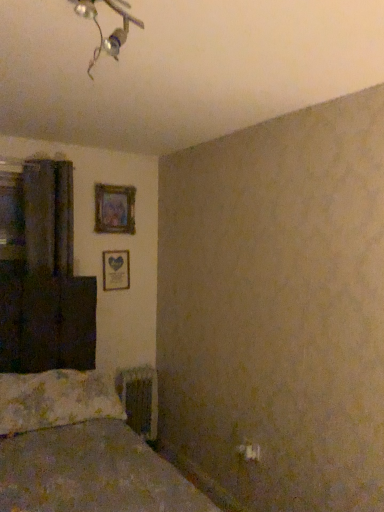
Consider the image. What is the approximate width of wooden frame at upper center, acting as the first picture frame starting from the top?

wooden frame at upper center, acting as the first picture frame starting from the top, is 2.17 inches wide.

From the picture: Measure the distance between metallic radiator at lower center and camera.

metallic radiator at lower center is 10.30 feet from camera.

Locate an element on the screen. The height and width of the screenshot is (512, 384). metallic silver light fixture at upper center is located at coordinates (101, 30).

In order to face wooden picture frame at center-left, which appears as the second picture frame when viewed from the top, should I rotate leftwards or rightwards?

To face it directly, rotate left by 10.067 degrees.

I want to click on wooden frame at upper center, the 2th picture frame ordered from the bottom, so click(x=114, y=209).

Consider the image. Between metallic silver light fixture at upper center and fluffy white pillow at lower left, which one is positioned in front?

metallic silver light fixture at upper center.

How far apart are metallic silver light fixture at upper center and fluffy white pillow at lower left?

metallic silver light fixture at upper center is 5.90 feet from fluffy white pillow at lower left.

Which object is positioned more to the left, metallic silver light fixture at upper center or fluffy white pillow at lower left?

Positioned to the left is fluffy white pillow at lower left.

How different are the orientations of metallic silver light fixture at upper center and fluffy white pillow at lower left in degrees?

The angle between the facing direction of metallic silver light fixture at upper center and the facing direction of fluffy white pillow at lower left is 28 degrees.

Is fluffy white pillow at lower left not close to metallic radiator at lower center?

They are positioned close to each other.

Relative to metallic radiator at lower center, is fluffy white pillow at lower left in front or behind?

fluffy white pillow at lower left is in front of metallic radiator at lower center.

Is fluffy white pillow at lower left facing away from metallic radiator at lower center?

fluffy white pillow at lower left is not turned away from metallic radiator at lower center.

From a real-world perspective, relative to dark matte curtain at left, is wooden picture frame at center-left, the first picture frame from the bottom, vertically above or below?

wooden picture frame at center-left, the first picture frame from the bottom, is situated lower than dark matte curtain at left in the real world.

From the image's perspective, is wooden picture frame at center-left, the first picture frame from the bottom, above dark matte curtain at left?

No, from the image's perspective, wooden picture frame at center-left, the first picture frame from the bottom, is not above dark matte curtain at left.

Which picture frame is the 2nd one when counting from the back of the dark matte curtain at left? Please provide its 2D coordinates.

[(116, 270)]

Considering the relative sizes of wooden picture frame at center-left, the first picture frame from the bottom, and dark matte curtain at left in the image provided, is wooden picture frame at center-left, the first picture frame from the bottom, bigger than dark matte curtain at left?

No.

Is metallic radiator at lower center positioned in front of metallic silver light fixture at upper center?

No, metallic radiator at lower center is further to the viewer.

Which is less distant, (121, 372) or (123, 24)?

The point (123, 24) is more forward.

Does metallic radiator at lower center have a greater width compared to metallic silver light fixture at upper center?

No, metallic radiator at lower center is not wider than metallic silver light fixture at upper center.

From the image's perspective, is metallic radiator at lower center above metallic silver light fixture at upper center?

No.

Is metallic radiator at lower center in front of or behind wooden picture frame at center-left, the first picture frame from the bottom, in the image?

metallic radiator at lower center is positioned closer to the viewer than wooden picture frame at center-left, the first picture frame from the bottom.

Based on the photo, from a real-world perspective, which object rests below the other?

metallic radiator at lower center is physically lower.

Can you confirm if metallic radiator at lower center is shorter than wooden picture frame at center-left, which appears as the second picture frame when viewed from the top?

In fact, metallic radiator at lower center may be taller than wooden picture frame at center-left, which appears as the second picture frame when viewed from the top.

From a real-world perspective, is fluffy white pillow at lower left above or below dark matte curtain at left?

Clearly, from a real-world perspective, fluffy white pillow at lower left is below dark matte curtain at left.

Would you say fluffy white pillow at lower left is a long distance from dark matte curtain at left?

No, fluffy white pillow at lower left is not far from dark matte curtain at left.

Is fluffy white pillow at lower left to the left of dark matte curtain at left from the viewer's perspective?

No, fluffy white pillow at lower left is not to the left of dark matte curtain at left.

Which of these two, wooden frame at upper center, acting as the first picture frame starting from the top, or fluffy white pillow at lower left, is bigger?

fluffy white pillow at lower left.

Where is `pillow lying in front of the wooden frame at upper center, the 2th picture frame ordered from the bottom`? The height and width of the screenshot is (512, 384). pillow lying in front of the wooden frame at upper center, the 2th picture frame ordered from the bottom is located at coordinates (56, 399).

Considering the relative sizes of wooden frame at upper center, the 2th picture frame ordered from the bottom, and fluffy white pillow at lower left in the image provided, is wooden frame at upper center, the 2th picture frame ordered from the bottom, thinner than fluffy white pillow at lower left?

Yes, wooden frame at upper center, the 2th picture frame ordered from the bottom, is thinner than fluffy white pillow at lower left.

Measure the distance from wooden frame at upper center, acting as the first picture frame starting from the top, to fluffy white pillow at lower left.

The distance of wooden frame at upper center, acting as the first picture frame starting from the top, from fluffy white pillow at lower left is 1.26 meters.

Where is `light fixture on the right of fluffy white pillow at lower left`? This screenshot has width=384, height=512. light fixture on the right of fluffy white pillow at lower left is located at coordinates (101, 30).

Find the location of a particular element. The image size is (384, 512). pillow in front of the metallic radiator at lower center is located at coordinates (56, 399).

Looking at the image, which one is located closer to metallic radiator at lower center, fluffy white pillow at lower left or wooden picture frame at center-left, which appears as the second picture frame when viewed from the top?

The object closer to metallic radiator at lower center is fluffy white pillow at lower left.

Which object lies further to the anchor point wooden picture frame at center-left, the first picture frame from the bottom, fluffy white pillow at lower left or wooden frame at upper center, acting as the first picture frame starting from the top?

fluffy white pillow at lower left.

Considering their positions, is metallic silver light fixture at upper center positioned further to wooden frame at upper center, the 2th picture frame ordered from the bottom, than dark matte curtain at left?

Among the two, metallic silver light fixture at upper center is located further to wooden frame at upper center, the 2th picture frame ordered from the bottom.

When comparing their distances from fluffy white pillow at lower left, does wooden frame at upper center, acting as the first picture frame starting from the top, or metallic silver light fixture at upper center seem further?

metallic silver light fixture at upper center lies further to fluffy white pillow at lower left than the other object.

When comparing their distances from metallic silver light fixture at upper center, does fluffy white pillow at lower left or dark matte curtain at left seem further?

Based on the image, fluffy white pillow at lower left appears to be further to metallic silver light fixture at upper center.

Estimate the real-world distances between objects in this image. Which object is further from metallic silver light fixture at upper center, dark matte curtain at left or metallic radiator at lower center?

metallic radiator at lower center is positioned further to the anchor metallic silver light fixture at upper center.

Considering their positions, is dark matte curtain at left positioned further to wooden frame at upper center, the 2th picture frame ordered from the bottom, than metallic silver light fixture at upper center?

The object further to wooden frame at upper center, the 2th picture frame ordered from the bottom, is metallic silver light fixture at upper center.

Looking at the image, which one is located closer to dark matte curtain at left, metallic radiator at lower center or metallic silver light fixture at upper center?

metallic radiator at lower center is positioned closer to the anchor dark matte curtain at left.

The width and height of the screenshot is (384, 512). Identify the location of curtain between metallic silver light fixture at upper center and wooden frame at upper center, the 2th picture frame ordered from the bottom, from front to back. (49, 215).

I want to click on pillow between metallic silver light fixture at upper center and wooden frame at upper center, acting as the first picture frame starting from the top, along the z-axis, so click(56, 399).

In order to click on radiator between fluffy white pillow at lower left and wooden picture frame at center-left, which appears as the second picture frame when viewed from the top, from front to back in this screenshot , I will do `click(140, 399)`.

Find the location of a particular element. The image size is (384, 512). curtain between wooden frame at upper center, acting as the first picture frame starting from the top, and metallic radiator at lower center in the up-down direction is located at coordinates (49, 215).